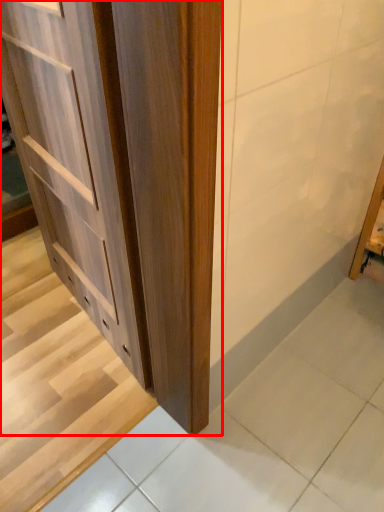
Question: From the image's perspective, what is the correct spatial relationship of cupboard (annotated by the red box) in relation to stairwell?

Choices:
 (A) below
 (B) above

Answer: (B)